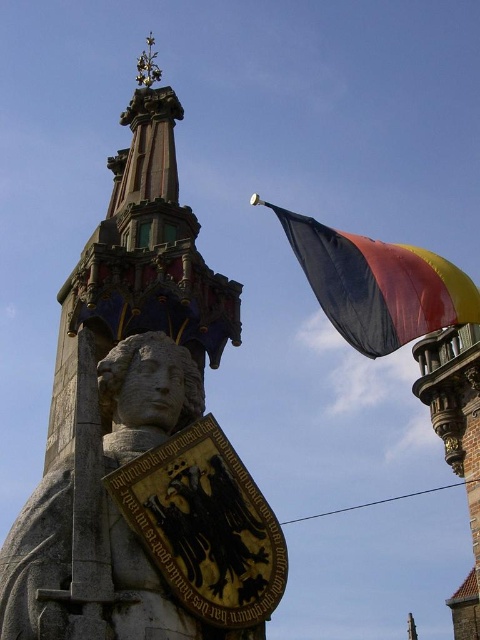
Does stone statue at center have a lesser width compared to polyester flag at upper right?

Correct, stone statue at center's width is less than polyester flag at upper right's.

Which of these two, stone statue at center or polyester flag at upper right, stands shorter?

stone statue at center is shorter.

Is point (267, 528) positioned in front of point (320, 275)?

Yes, it is.

Find the location of a particular element. stone statue at center is located at coordinates (145, 518).